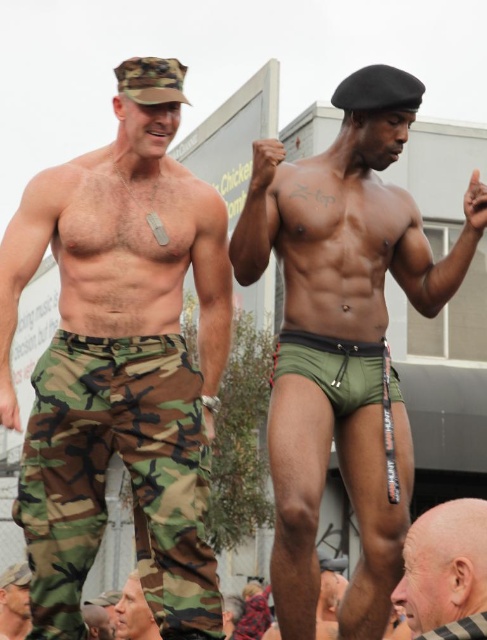
You are a photographer trying to capture a wide shot of the bald head at lower right and the camouflage pants at center. Given that your camera has a maximum focus range of 100 feet, will you be able to include both subjects in the same frame without losing focus on either?

The bald head at lower right and camouflage pants at center are 108.02 feet apart from each other, which exceeds the camera maximum focus range of 100 feet. Therefore, you cannot include both subjects in the same frame without losing focus on either.

You are standing at the origin point in the image and want to reach the point at the bottom right corner. Which point should you pass through first, point (419, 598) or point (22, 593)?

You should pass through point (419, 598) first because it is in front of point (22, 593) from your perspective.

You are trying to determine the spatial relationship between the green matte shorts at center and the bald head at lower right. Based on their positions in the image, which one appears taller?

The green matte shorts at center has a greater height compared to bald head at lower right, so the green matte shorts at center appears taller.